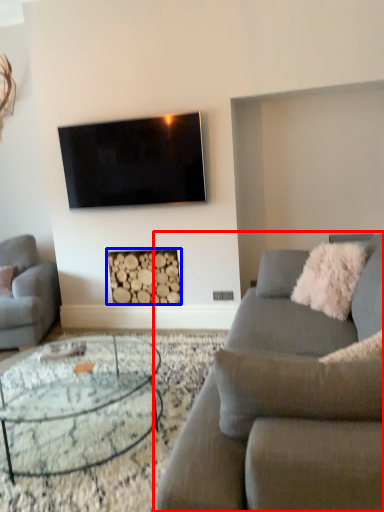
Question: Which of the following is the farthest to the observer, studio couch (highlighted by a red box) or fireplace (highlighted by a blue box)?

Choices:
 (A) studio couch
 (B) fireplace

Answer: (B)